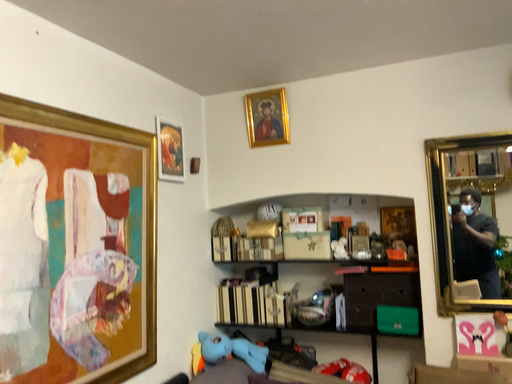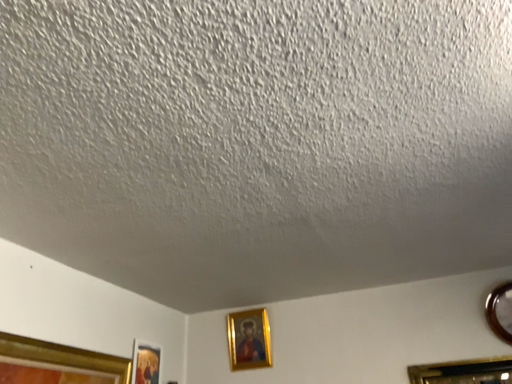
Question: Which way did the camera rotate in the video?

Choices:
 (A) rotated upward
 (B) rotated downward

Answer: (A)